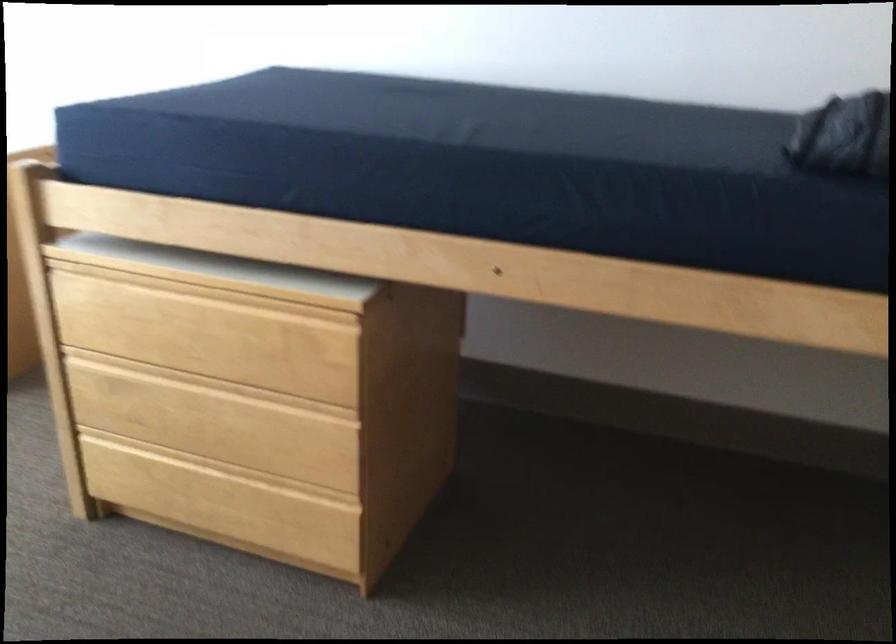
The width and height of the screenshot is (896, 644). What do you see at coordinates (194, 381) in the screenshot? I see `the middle drawer handle` at bounding box center [194, 381].